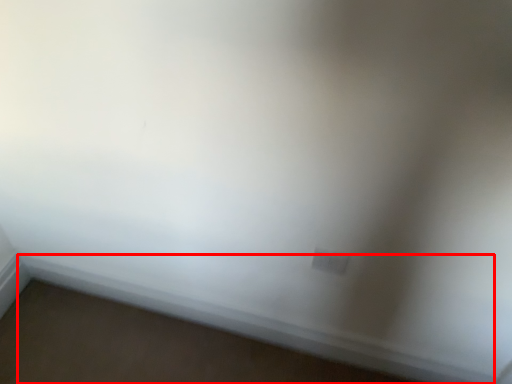
Question: From the image, what is the correct spatial relationship of window sill (annotated by the red box) in relation to electric outlet?

Choices:
 (A) right
 (B) left

Answer: (B)